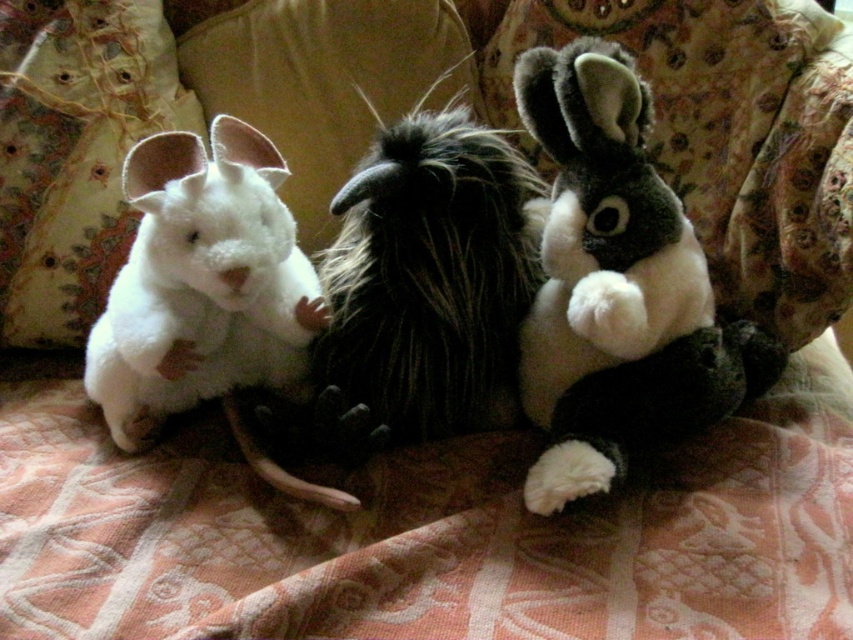
Who is more distant from viewer, (567, 67) or (135, 352)?

Positioned behind is point (567, 67).

Who is lower down, fluffy white and black plush rabbit at center or white plush rabbit at left?

fluffy white and black plush rabbit at center

Find the location of a particular element. This screenshot has width=853, height=640. fluffy white and black plush rabbit at center is located at coordinates (616, 288).

Image resolution: width=853 pixels, height=640 pixels. I want to click on fluffy white and black plush rabbit at center, so click(616, 288).

Does white plush rabbit at left have a larger size compared to white plush pillow at left?

Yes.

Does point (143, 358) lie in front of point (44, 60)?

Yes.

Is point (177, 317) positioned after point (100, 74)?

No, it is in front of (100, 74).

In order to click on white plush rabbit at left in this screenshot , I will do `click(201, 282)`.

Who is taller, fluffy white and black plush rabbit at center or white plush pillow at left?

Standing taller between the two is fluffy white and black plush rabbit at center.

Is fluffy white and black plush rabbit at center thinner than white plush pillow at left?

Incorrect, fluffy white and black plush rabbit at center's width is not less than white plush pillow at left's.

Locate an element on the screen. The width and height of the screenshot is (853, 640). fluffy white and black plush rabbit at center is located at coordinates (616, 288).

The image size is (853, 640). Identify the location of fluffy white and black plush rabbit at center. (616, 288).